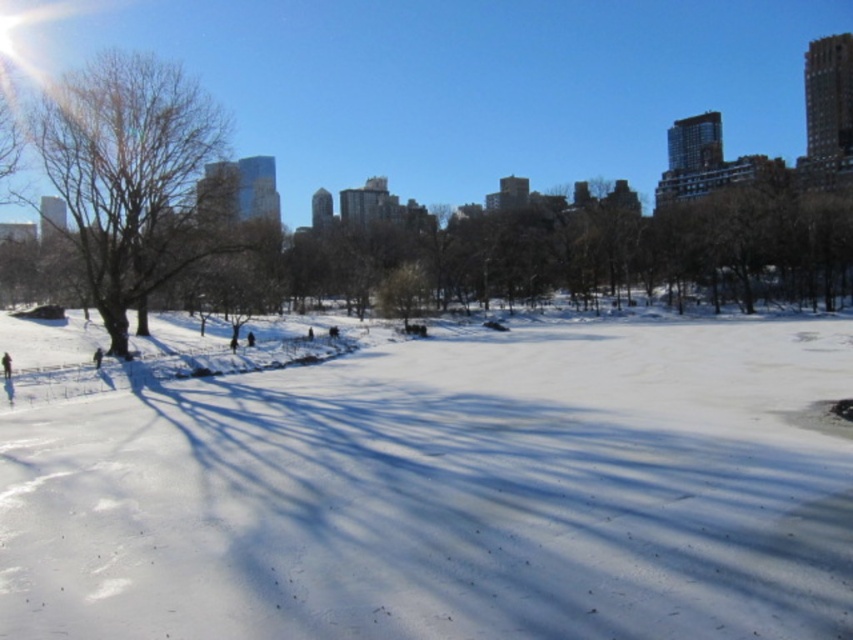
Question: Which point is closer to the camera?

Choices:
 (A) bare brown tree at left
 (B) white powdery snow at center
 (C) dark blue jacket at lower left

Answer: (B)

Question: Which of the following is the farthest from the observer?

Choices:
 (A) bare brown tree at left
 (B) dark blue jacket at lower left

Answer: (A)

Question: Based on their relative distances, which object is nearer to the white powdery snow at center?

Choices:
 (A) bare brown tree at left
 (B) dark blue jacket at lower left

Answer: (A)

Question: Is bare brown tree at left bigger than dark blue jacket at lower left?

Choices:
 (A) yes
 (B) no

Answer: (A)

Question: Observing the image, what is the correct spatial positioning of white powdery snow at center in reference to dark blue jacket at lower left?

Choices:
 (A) left
 (B) right

Answer: (B)

Question: Is white powdery snow at center closer to the viewer compared to dark blue jacket at lower left?

Choices:
 (A) no
 (B) yes

Answer: (B)